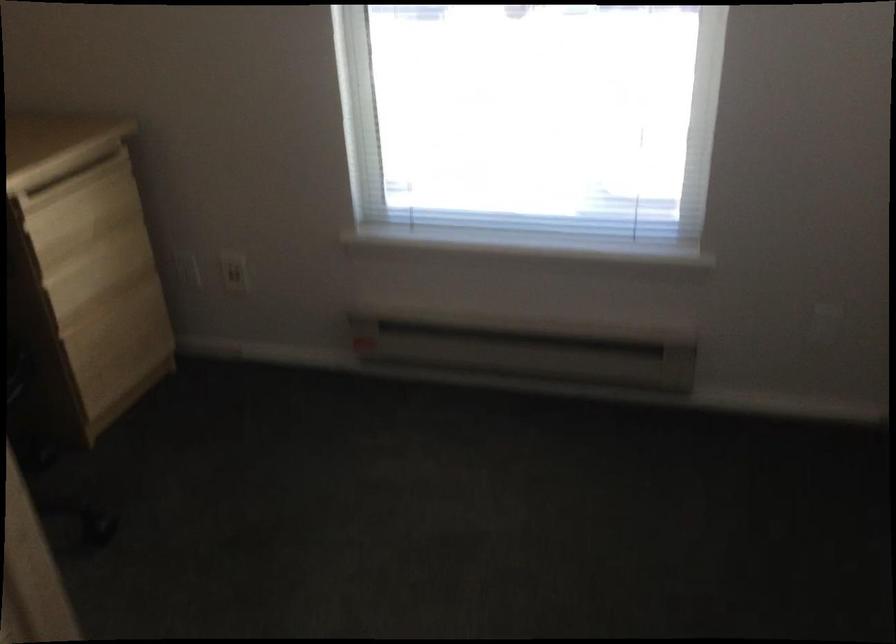
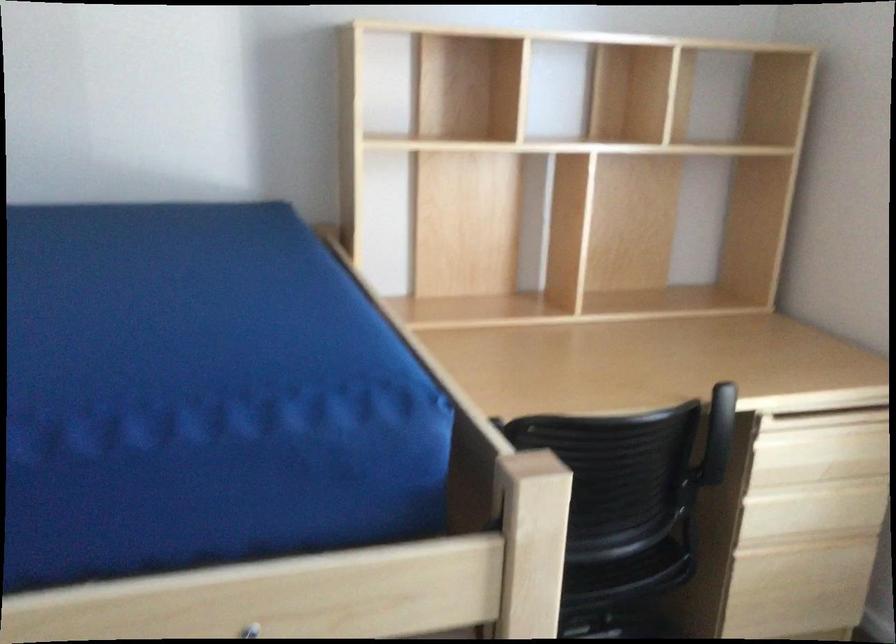
In the second image, find the point that corresponds to point 80,216 in the first image.

(819, 450)